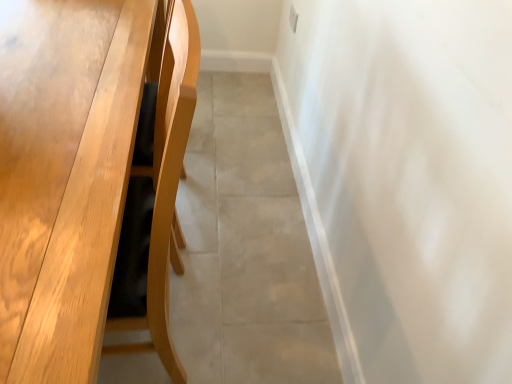
What is the approximate height of beige tile floor at center?

It is 1.75 inches.

The height and width of the screenshot is (384, 512). Describe the element at coordinates (245, 248) in the screenshot. I see `beige tile floor at center` at that location.

What are the coordinates of `beige tile floor at center` in the screenshot? It's located at (245, 248).

Find the location of `light brown wood table at left`. light brown wood table at left is located at coordinates (91, 181).

The height and width of the screenshot is (384, 512). What do you see at coordinates (91, 181) in the screenshot?
I see `light brown wood table at left` at bounding box center [91, 181].

The image size is (512, 384). Identify the location of beige tile floor at center. (245, 248).

Is light brown wood table at left to the left of beige tile floor at center from the viewer's perspective?

Indeed, light brown wood table at left is positioned on the left side of beige tile floor at center.

Is light brown wood table at left in front of or behind beige tile floor at center in the image?

Clearly, light brown wood table at left is in front of beige tile floor at center.

Is point (97, 175) behind point (269, 290)?

That is False.

From the image's perspective, is light brown wood table at left over beige tile floor at center?

Incorrect, from the image's perspective, light brown wood table at left is lower than beige tile floor at center.

From a real-world perspective, which is physically below, light brown wood table at left or beige tile floor at center?

In real-world perspective, beige tile floor at center is lower.

Is light brown wood table at left thinner than beige tile floor at center?

Incorrect, the width of light brown wood table at left is not less than that of beige tile floor at center.

Considering the relative sizes of light brown wood table at left and beige tile floor at center in the image provided, is light brown wood table at left shorter than beige tile floor at center?

No, light brown wood table at left is not shorter than beige tile floor at center.

Looking at this image, looking at the image, does light brown wood table at left seem bigger or smaller compared to beige tile floor at center?

Considering their sizes, light brown wood table at left takes up more space than beige tile floor at center.

Is light brown wood table at left inside or outside of beige tile floor at center?

light brown wood table at left lies outside beige tile floor at center.

Is light brown wood table at left not near beige tile floor at center?

light brown wood table at left is actually quite close to beige tile floor at center.

Is light brown wood table at left oriented towards beige tile floor at center?

No, light brown wood table at left does not turn towards beige tile floor at center.

Consider the image. How far apart are light brown wood table at left and beige tile floor at center?

light brown wood table at left and beige tile floor at center are 23.93 inches apart.

Where is `concrete that appears above the light brown wood table at left (from the image's perspective)`? concrete that appears above the light brown wood table at left (from the image's perspective) is located at coordinates (245, 248).

Which object is positioned more to the left, beige tile floor at center or light brown wood table at left?

From the viewer's perspective, light brown wood table at left appears more on the left side.

Considering the relative positions of beige tile floor at center and light brown wood table at left in the image provided, is beige tile floor at center in front of light brown wood table at left?

No, beige tile floor at center is further to the viewer.

Which point is more distant from viewer, (x=111, y=341) or (x=24, y=47)?

Point (x=24, y=47)

From the image's perspective, is beige tile floor at center on light brown wood table at left?

Yes, from the image's perspective, beige tile floor at center is on top of light brown wood table at left.

From a real-world perspective, which object stands above the other?

light brown wood table at left is physically above.

In the scene shown: Looking at their sizes, would you say beige tile floor at center is wider or thinner than light brown wood table at left?

beige tile floor at center is thinner than light brown wood table at left.

Is beige tile floor at center taller or shorter than light brown wood table at left?

In the image, beige tile floor at center appears to be shorter than light brown wood table at left.

Considering the sizes of beige tile floor at center and light brown wood table at left in the image, is beige tile floor at center bigger or smaller than light brown wood table at left?

Considering their sizes, beige tile floor at center takes up less space than light brown wood table at left.

Is beige tile floor at center completely or partially outside of light brown wood table at left?

That's correct, beige tile floor at center is outside of light brown wood table at left.

Are beige tile floor at center and light brown wood table at left making contact?

beige tile floor at center and light brown wood table at left are clearly separated.

Does beige tile floor at center turn towards light brown wood table at left?

No, beige tile floor at center is not turned towards light brown wood table at left.

How different are the orientations of beige tile floor at center and light brown wood table at left in degrees?

1.16 degrees separate the facing orientations of beige tile floor at center and light brown wood table at left.

Consider the image. How much distance is there between beige tile floor at center and light brown wood table at left?

beige tile floor at center is 23.93 inches from light brown wood table at left.

Image resolution: width=512 pixels, height=384 pixels. In the image, there is a light brown wood table at left. What are the coordinates of `concrete above it (from the image's perspective)` in the screenshot? It's located at (245, 248).

What are the coordinates of `table that appears in front of the beige tile floor at center` in the screenshot? It's located at (91, 181).

In the image, there is a light brown wood table at left. Where is `concrete below it (from a real-world perspective)`? Image resolution: width=512 pixels, height=384 pixels. concrete below it (from a real-world perspective) is located at coordinates (245, 248).